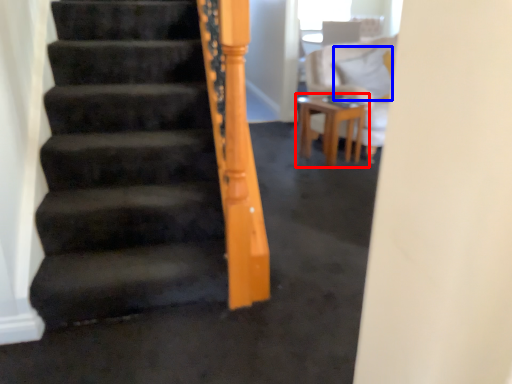
Question: Among these objects, which one is farthest to the camera, table (highlighted by a red box) or pillow (highlighted by a blue box)?

Choices:
 (A) table
 (B) pillow

Answer: (B)